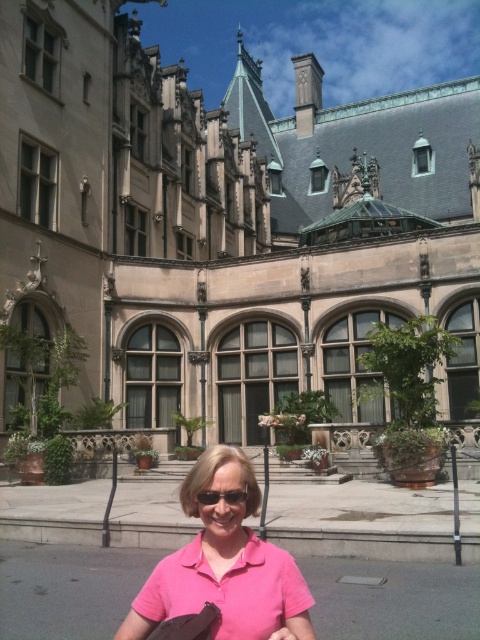
Question: Does pink fabric at center have a smaller size compared to sunglasses at center?

Choices:
 (A) no
 (B) yes

Answer: (A)

Question: Can you confirm if pink fabric at center is smaller than sunglasses at center?

Choices:
 (A) no
 (B) yes

Answer: (A)

Question: Among these points, which one is farthest from the camera?

Choices:
 (A) (249, 634)
 (B) (285, 632)

Answer: (A)

Question: Which point is closer to the camera?

Choices:
 (A) pink fabric at center
 (B) sunglasses at center
 (C) pink fabric at lower center

Answer: (C)

Question: Which object is the farthest from the pink fabric at lower center?

Choices:
 (A) sunglasses at center
 (B) pink fabric at center

Answer: (A)

Question: Observing the image, what is the correct spatial positioning of pink fabric at center in reference to sunglasses at center?

Choices:
 (A) right
 (B) left

Answer: (B)